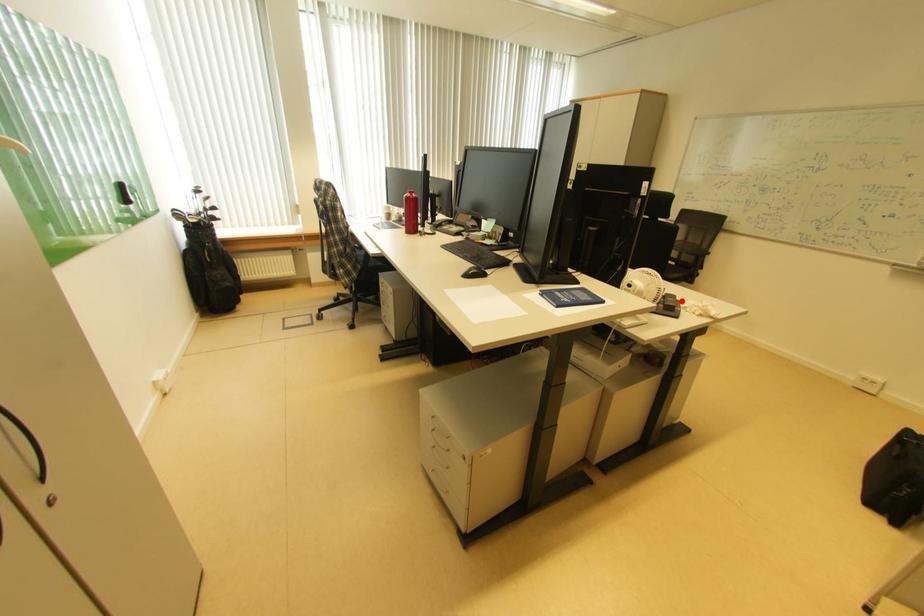
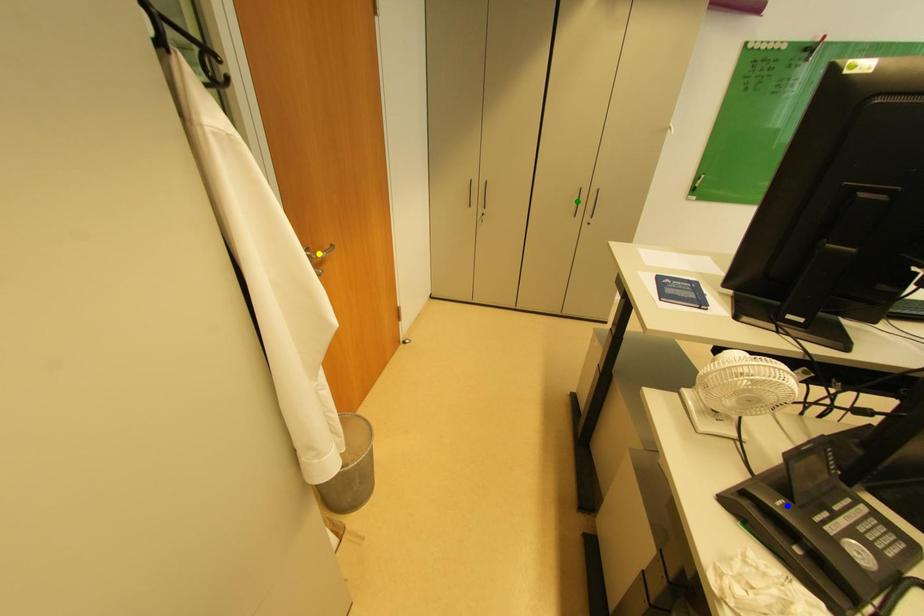
Question: I am providing you with two images of the same scene from different viewpoints. A red point is marked on the first image. You are given multiple points on the second image. Which point in image 2 is actually the same real-world point as the red point in image 1?

Choices:
 (A) yellow point
 (B) green point
 (C) blue point

Answer: (C)